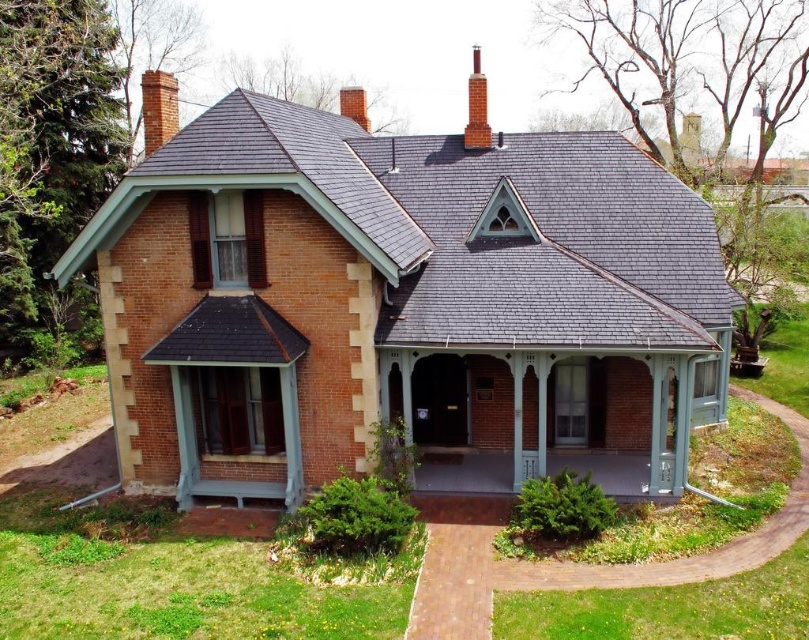
Question: Which point is closer to the camera taking this photo?

Choices:
 (A) (464, 472)
 (B) (486, 124)
 (C) (361, 93)
 (D) (176, 77)

Answer: (A)

Question: Does brick chimney at upper left have a lesser width compared to brick chimney at upper center?

Choices:
 (A) yes
 (B) no

Answer: (B)

Question: Which point appears farthest from the camera in this image?

Choices:
 (A) (468, 456)
 (B) (477, 90)

Answer: (B)

Question: Which of these objects is positioned closest to the brick chimney at upper left?

Choices:
 (A) brick chimney at upper center
 (B) smooth concrete porch at center
 (C) red brick chimney at upper center

Answer: (C)

Question: Can you confirm if brick chimney at upper left is positioned below red brick chimney at upper center?

Choices:
 (A) no
 (B) yes

Answer: (B)

Question: Is smooth concrete porch at center above red brick chimney at upper center?

Choices:
 (A) no
 (B) yes

Answer: (A)